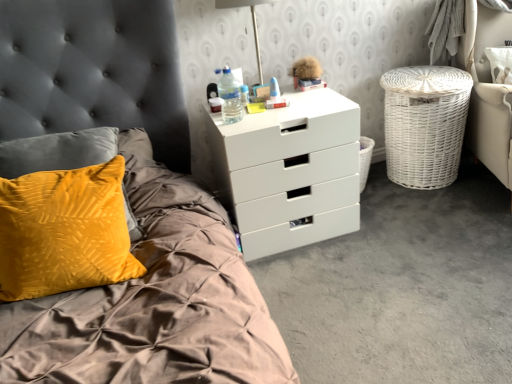
Question: Can you confirm if translucent plastic water bottle at upper right is taller than white plastic chest of drawers at upper center?

Choices:
 (A) no
 (B) yes

Answer: (A)

Question: Does translucent plastic water bottle at upper right have a smaller size compared to white plastic chest of drawers at upper center?

Choices:
 (A) yes
 (B) no

Answer: (A)

Question: Considering the relative positions of translucent plastic water bottle at upper right and white plastic chest of drawers at upper center in the image provided, is translucent plastic water bottle at upper right in front of white plastic chest of drawers at upper center?

Choices:
 (A) yes
 (B) no

Answer: (B)

Question: Considering the relative sizes of translucent plastic water bottle at upper right and white plastic chest of drawers at upper center in the image provided, is translucent plastic water bottle at upper right shorter than white plastic chest of drawers at upper center?

Choices:
 (A) no
 (B) yes

Answer: (B)

Question: Is translucent plastic water bottle at upper right looking in the opposite direction of white plastic chest of drawers at upper center?

Choices:
 (A) no
 (B) yes

Answer: (A)

Question: Is point (430, 92) closer or farther from the camera than point (253, 21)?

Choices:
 (A) farther
 (B) closer

Answer: (A)

Question: Considering the positions of white wicker laundry basket at right and metallic silver lamp at upper center in the image, is white wicker laundry basket at right bigger or smaller than metallic silver lamp at upper center?

Choices:
 (A) big
 (B) small

Answer: (A)

Question: Is white wicker laundry basket at right inside the boundaries of metallic silver lamp at upper center, or outside?

Choices:
 (A) outside
 (B) inside

Answer: (A)

Question: In terms of height, does white wicker laundry basket at right look taller or shorter compared to metallic silver lamp at upper center?

Choices:
 (A) short
 (B) tall

Answer: (B)

Question: Is white plastic chest of drawers at upper center wider or thinner than white wicker laundry basket at right?

Choices:
 (A) thin
 (B) wide

Answer: (B)

Question: From their relative heights in the image, would you say white plastic chest of drawers at upper center is taller or shorter than white wicker laundry basket at right?

Choices:
 (A) tall
 (B) short

Answer: (A)

Question: Is point click(x=347, y=231) positioned closer to the camera than point click(x=425, y=104)?

Choices:
 (A) farther
 (B) closer

Answer: (B)

Question: From the image's perspective, is white plastic chest of drawers at upper center positioned above or below white wicker laundry basket at right?

Choices:
 (A) above
 (B) below

Answer: (B)

Question: Relative to white plastic chest of drawers at upper center, is metallic silver lamp at upper center in front or behind?

Choices:
 (A) front
 (B) behind

Answer: (B)

Question: Is point tap(234, 0) positioned closer to the camera than point tap(271, 236)?

Choices:
 (A) closer
 (B) farther

Answer: (B)